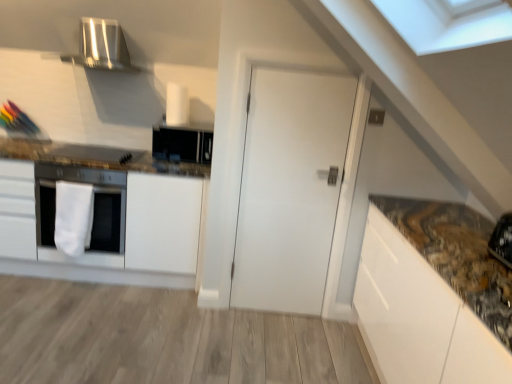
Where is `free space to the left of white matte door at center`? The width and height of the screenshot is (512, 384). free space to the left of white matte door at center is located at coordinates (214, 314).